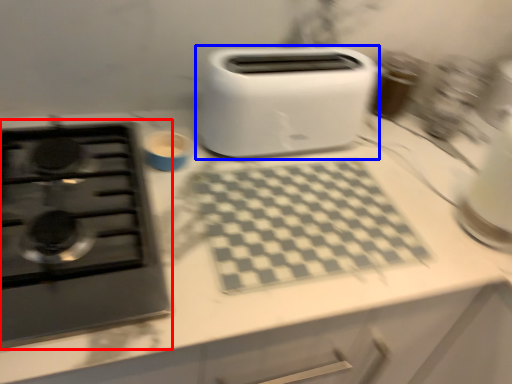
Question: Which of the following is the farthest to the observer, gas stove (highlighted by a red box) or toaster (highlighted by a blue box)?

Choices:
 (A) gas stove
 (B) toaster

Answer: (B)